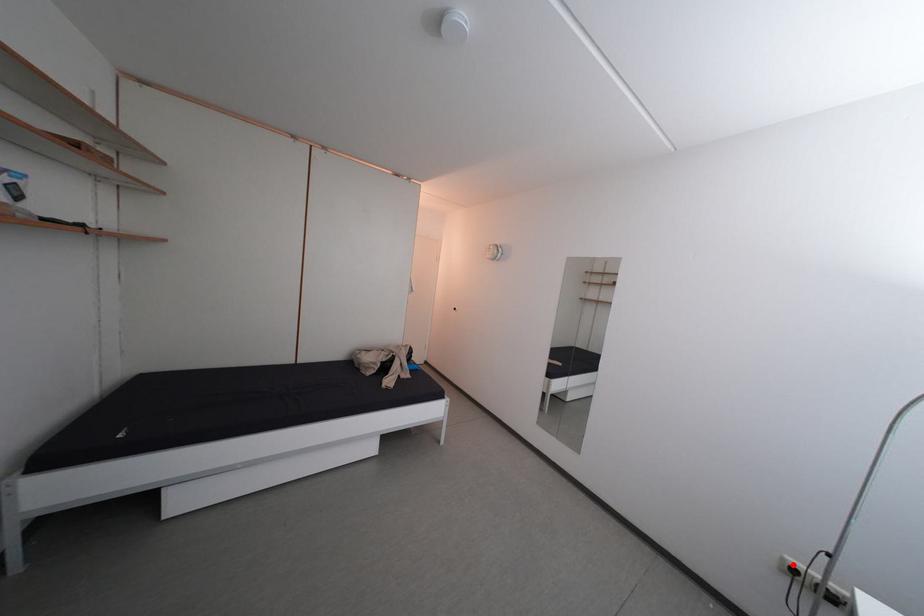
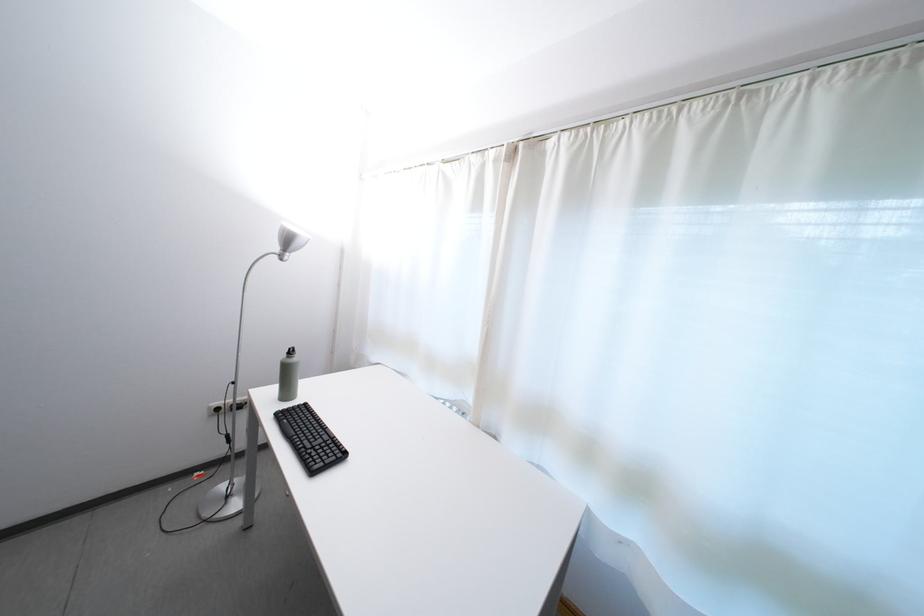
The point at the highlighted location is marked in the first image. Where is the corresponding point in the second image?

(219, 413)